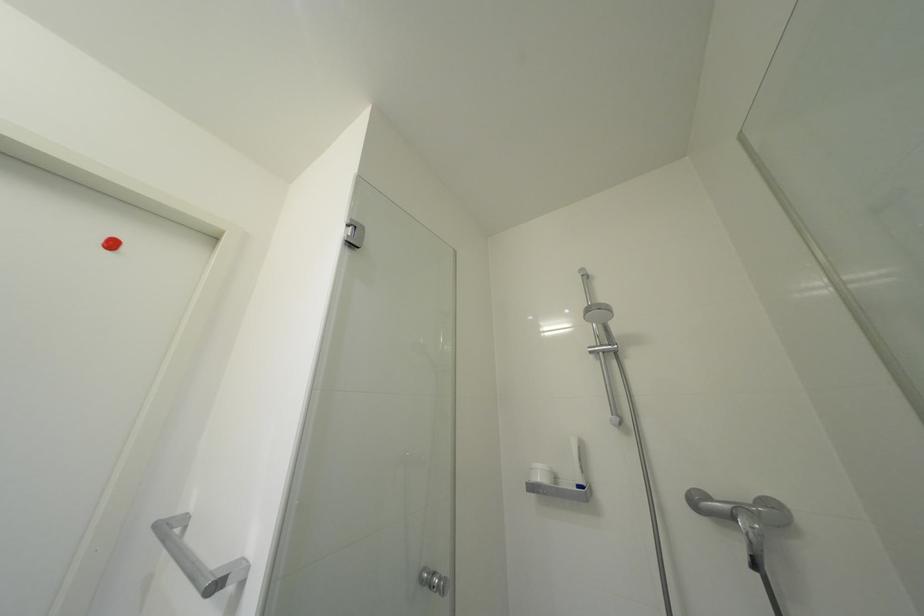
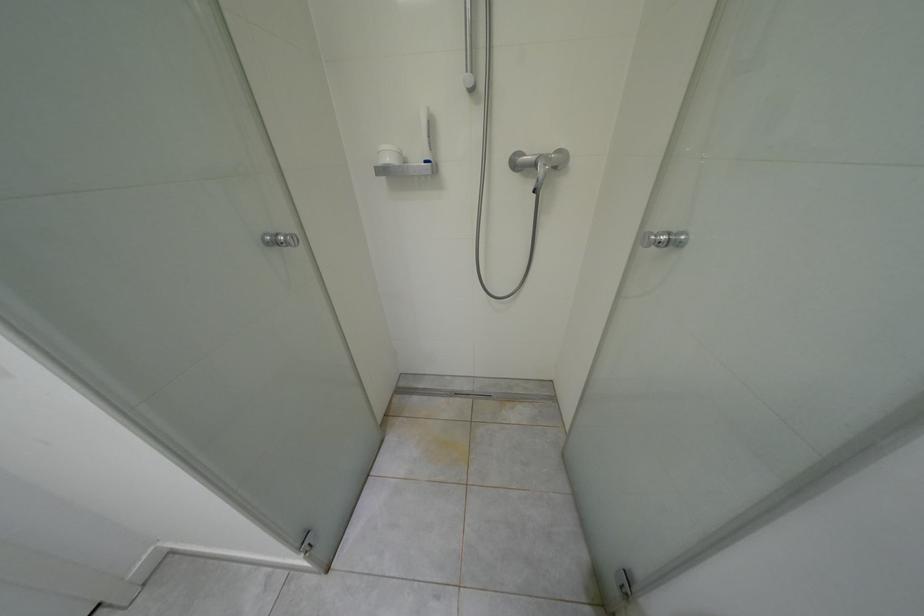
How did the camera likely rotate?

The camera's rotation is toward right-down.